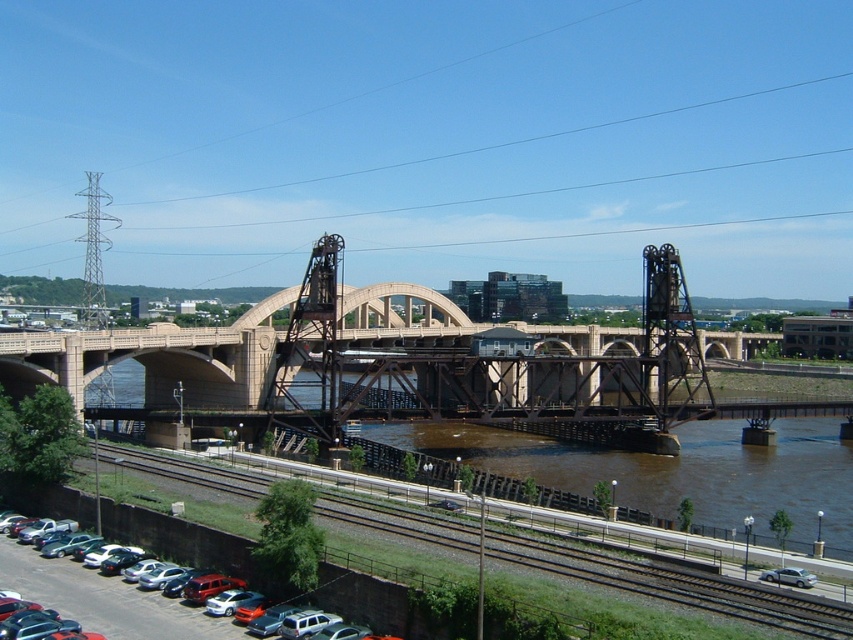
You are a photographer positioned at the center of the bridge. You want to take a photo that includes both the silver metallic sedan at lower left and the silver metallic sedan at lower right. Which sedan should you frame closer to the edge of the photo to ensure both are visible?

You should frame the silver metallic sedan at lower right closer to the edge of the photo because it is smaller than the silver metallic sedan at lower left, allowing both to fit within the frame.

You are standing at the base of the bridge and want to cross to the other side. You notice the smooth asphalt train track at lower left and the silver metallic sedan at lower left. Which object is closer to you?

The smooth asphalt train track at lower left is closer to the viewer than the silver metallic sedan at lower left.